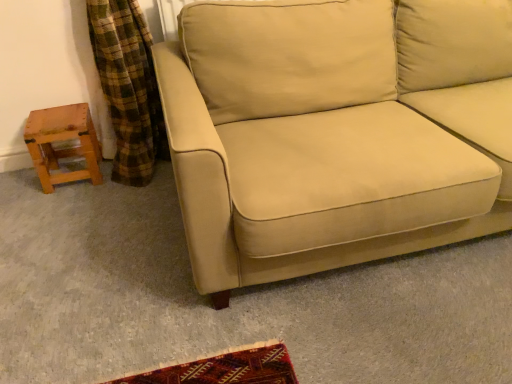
Image resolution: width=512 pixels, height=384 pixels. What are the coordinates of `vacant area in front of wooden stool at left` in the screenshot? It's located at (57, 198).